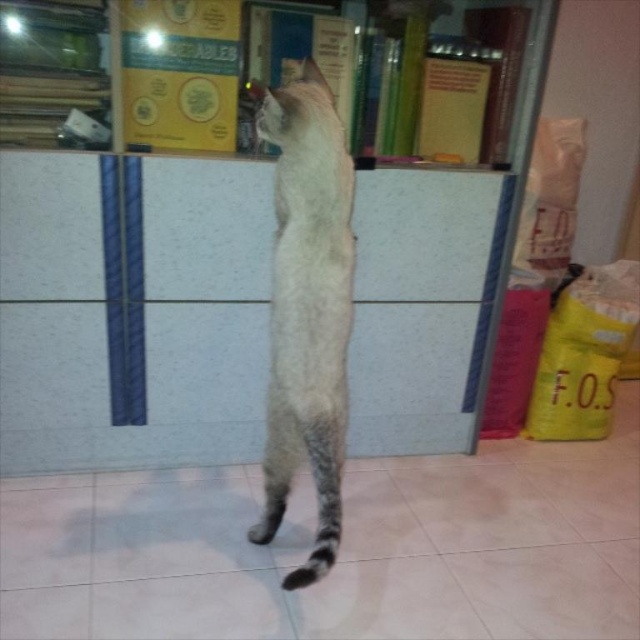
Is light gray fur cat at center thinner than gray striped tail at lower center?

Incorrect, light gray fur cat at center's width is not less than gray striped tail at lower center's.

Between light gray fur cat at center and gray striped tail at lower center, which one is positioned lower?

Answer: gray striped tail at lower center is lower down.

Is point (310, 552) positioned before point (317, 525)?

Yes, point (310, 552) is in front of point (317, 525).

You are a GUI agent. You are given a task and a screenshot of the screen. Output one action in this format:
    pyautogui.click(x=<x>, y=<y>)
    Task: Click on the light gray fur cat at center
    This screenshot has height=640, width=640.
    Given the screenshot: What is the action you would take?
    pyautogui.click(x=307, y=308)

Between point (184, 436) and point (284, 420), which one is positioned behind?

The point (184, 436) is behind.

Which of these two, white textured bookshelf at upper center or light gray fur cat at center, stands taller?

light gray fur cat at center

Identify the location of white textured bookshelf at upper center. (x=131, y=312).

Which is in front, point (412, 417) or point (336, 532)?

Positioned in front is point (336, 532).

Between white textured bookshelf at upper center and gray striped tail at lower center, which one appears on the left side from the viewer's perspective?

From the viewer's perspective, white textured bookshelf at upper center appears more on the left side.

Which is behind, point (51, 388) or point (339, 532)?

Point (51, 388)

Where is `white textured bookshelf at upper center`? Image resolution: width=640 pixels, height=640 pixels. white textured bookshelf at upper center is located at coordinates (131, 312).